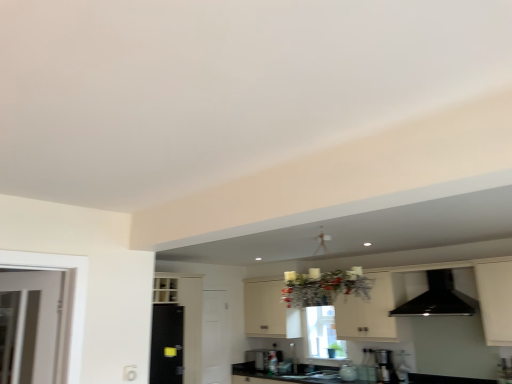
Question: Is black glossy sink at center, placed as the first sink when sorted from bottom to top, to the left of metallic silver toaster at center from the viewer's perspective?

Choices:
 (A) no
 (B) yes

Answer: (A)

Question: Does black glossy sink at center, which is the second sink from top to bottom, touch metallic silver toaster at center?

Choices:
 (A) no
 (B) yes

Answer: (A)

Question: Considering the relative sizes of black glossy sink at center, which is the second sink from top to bottom, and metallic silver toaster at center in the image provided, is black glossy sink at center, which is the second sink from top to bottom, wider than metallic silver toaster at center?

Choices:
 (A) yes
 (B) no

Answer: (A)

Question: Is black glossy sink at center, placed as the first sink when sorted from bottom to top, positioned before metallic silver toaster at center?

Choices:
 (A) yes
 (B) no

Answer: (A)

Question: Does black glossy sink at center, placed as the first sink when sorted from bottom to top, have a lesser height compared to metallic silver toaster at center?

Choices:
 (A) yes
 (B) no

Answer: (A)

Question: Considering the positions of point (487, 301) and point (417, 296), is point (487, 301) closer or farther from the camera than point (417, 296)?

Choices:
 (A) farther
 (B) closer

Answer: (B)

Question: From their relative heights in the image, would you say white matte cabinet at center is taller or shorter than black glossy exhaust hood at upper right?

Choices:
 (A) short
 (B) tall

Answer: (B)

Question: Considering the positions of white matte cabinet at center and black glossy exhaust hood at upper right in the image, is white matte cabinet at center bigger or smaller than black glossy exhaust hood at upper right?

Choices:
 (A) big
 (B) small

Answer: (A)

Question: Would you say white matte cabinet at center is inside or outside black glossy exhaust hood at upper right?

Choices:
 (A) inside
 (B) outside

Answer: (B)

Question: Is white matte door at center wider or thinner than black glossy exhaust hood at upper right?

Choices:
 (A) wide
 (B) thin

Answer: (B)

Question: Based on their sizes in the image, would you say white matte door at center is bigger or smaller than black glossy exhaust hood at upper right?

Choices:
 (A) big
 (B) small

Answer: (B)

Question: Would you say white matte door at center is inside or outside black glossy exhaust hood at upper right?

Choices:
 (A) outside
 (B) inside

Answer: (A)

Question: Visually, is white matte door at center positioned to the left or to the right of black glossy exhaust hood at upper right?

Choices:
 (A) left
 (B) right

Answer: (A)

Question: Is black glossy exhaust hood at upper right wider or thinner than white matte cabinet at center?

Choices:
 (A) wide
 (B) thin

Answer: (A)

Question: Is black glossy exhaust hood at upper right bigger or smaller than white matte cabinet at center?

Choices:
 (A) big
 (B) small

Answer: (B)